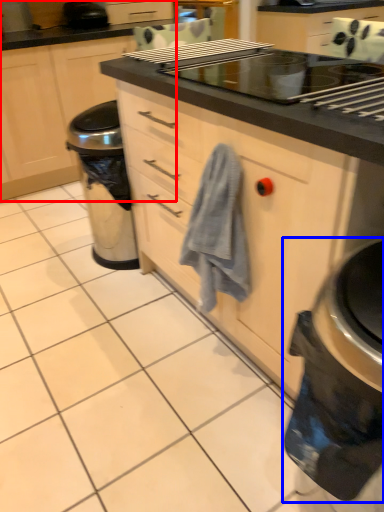
Question: Which object is further to the camera taking this photo, cabinetry (highlighted by a red box) or home appliance (highlighted by a blue box)?

Choices:
 (A) cabinetry
 (B) home appliance

Answer: (A)